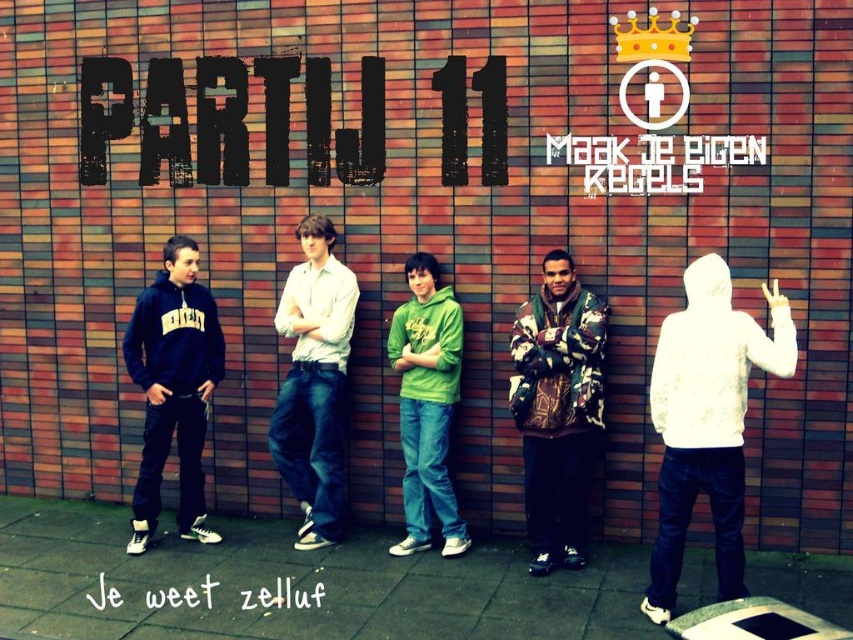
In order to click on camouflage jacket at center in this screenshot , I will do `click(556, 406)`.

Identify the location of camouflage jacket at center. This screenshot has height=640, width=853. (556, 406).

Does white hoodie at center have a smaller size compared to matte black hoodie at left?

No.

Is white hoodie at center shorter than matte black hoodie at left?

Yes.

Which is in front, point (657, 416) or point (152, 460)?

Positioned in front is point (657, 416).

Where is `white hoodie at center`? The height and width of the screenshot is (640, 853). white hoodie at center is located at coordinates (706, 420).

Is camouflage jacket at center smaller than light beige shirt at center?

Incorrect, camouflage jacket at center is not smaller in size than light beige shirt at center.

Does camouflage jacket at center have a lesser width compared to light beige shirt at center?

No, camouflage jacket at center is not thinner than light beige shirt at center.

Between point (598, 307) and point (296, 380), which one is positioned in front?

Point (598, 307)

This screenshot has width=853, height=640. Find the location of `camouflage jacket at center`. camouflage jacket at center is located at coordinates (556, 406).